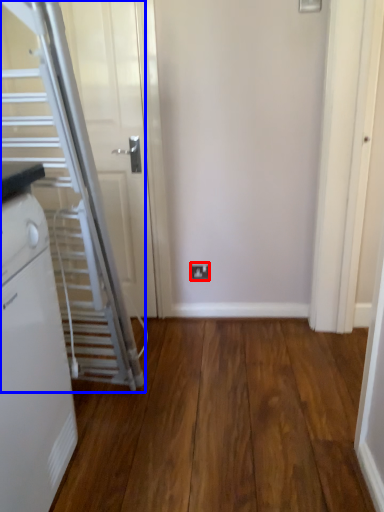
Question: Which object appears farthest to the camera in this image, electric outlet (highlighted by a red box) or escalator (highlighted by a blue box)?

Choices:
 (A) electric outlet
 (B) escalator

Answer: (A)